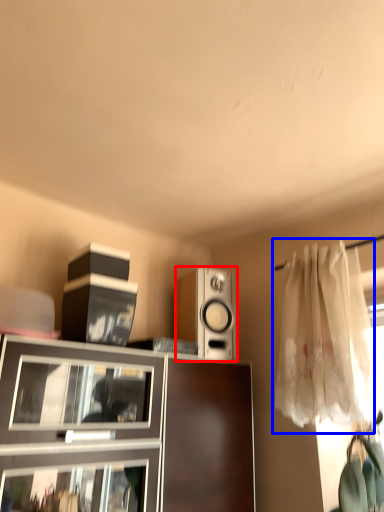
Question: Among these objects, which one is nearest to the camera, loudspeaker (highlighted by a red box) or curtain (highlighted by a blue box)?

Choices:
 (A) loudspeaker
 (B) curtain

Answer: (B)